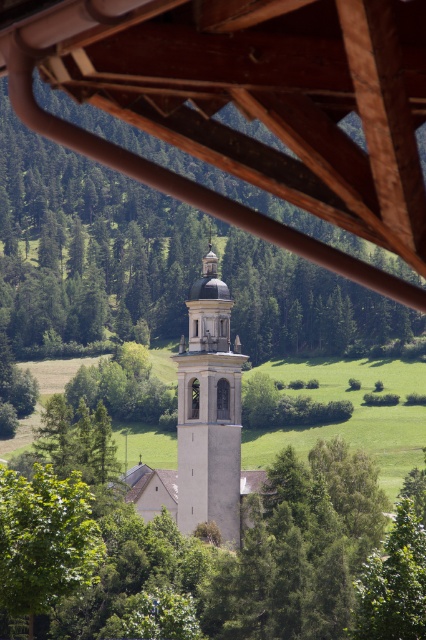
Question: Can you confirm if green leafy tree at center is wider than white stone tower at center?

Choices:
 (A) yes
 (B) no

Answer: (A)

Question: Which object appears closest to the camera in this image?

Choices:
 (A) green leafy tree at lower left
 (B) white stone tower at center
 (C) smooth white tower at center

Answer: (A)

Question: Considering the real-world distances, which object is farthest from the green leafy tree at center?

Choices:
 (A) white stone tower at center
 (B) smooth white tower at center

Answer: (B)

Question: Is green leafy tree at center positioned in front of smooth white tower at center?

Choices:
 (A) yes
 (B) no

Answer: (A)

Question: Is white stone tower at center positioned in front of green leafy tree at lower left?

Choices:
 (A) yes
 (B) no

Answer: (B)

Question: Which object is positioned farthest from the green leafy tree at lower left?

Choices:
 (A) white stone tower at center
 (B) green leafy tree at center

Answer: (B)